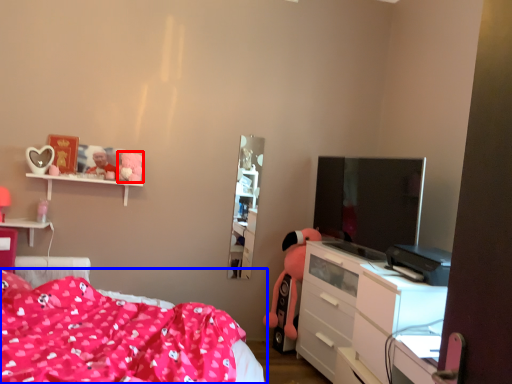
Question: Among these objects, which one is farthest to the camera, toy (highlighted by a red box) or bed (highlighted by a blue box)?

Choices:
 (A) toy
 (B) bed

Answer: (A)